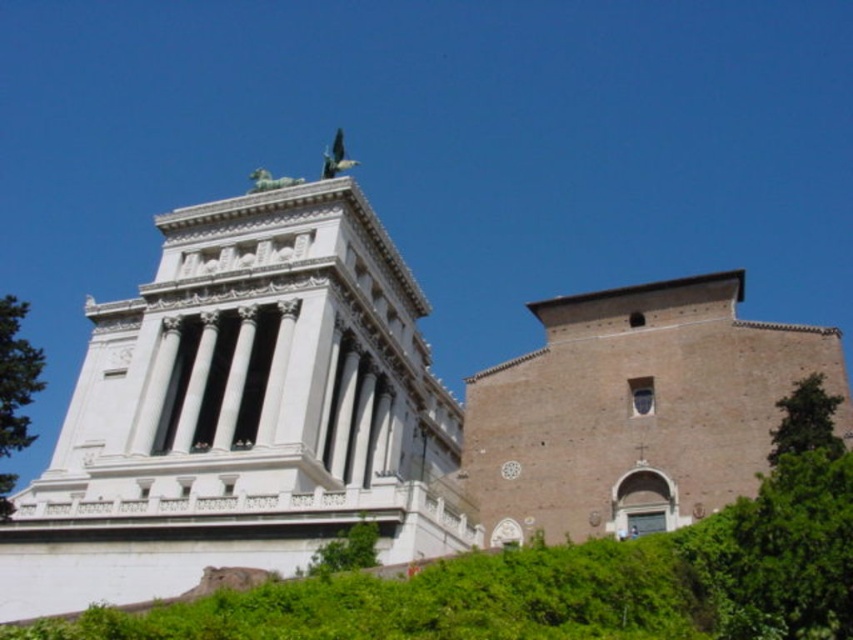
You are a gardener planning to trim the green leafy tree at right and the green leafy tree at lower center. Which tree requires a taller ladder to reach its branches?

The green leafy tree at lower center requires a taller ladder because it is taller than the green leafy tree at right.